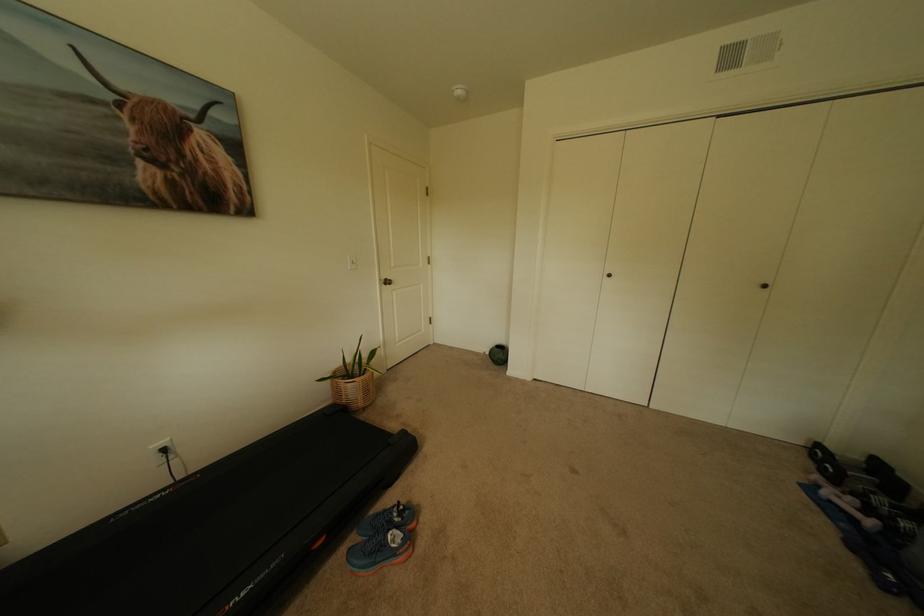
The width and height of the screenshot is (924, 616). In order to click on white light switch in this screenshot , I will do `click(351, 262)`.